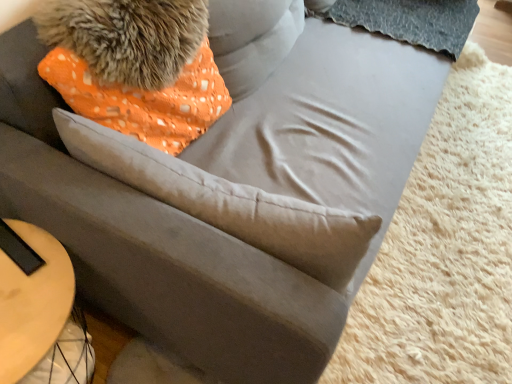
Question: In terms of height, does light wood table at lower left look taller or shorter compared to orange dotted fabric pillow at upper left?

Choices:
 (A) tall
 (B) short

Answer: (A)

Question: Is point (66, 271) positioned closer to the camera than point (176, 173)?

Choices:
 (A) closer
 (B) farther

Answer: (B)

Question: Which is nearer to the orange dotted fabric pillow at upper left?

Choices:
 (A) fuzzy fur at upper left
 (B) light wood table at lower left

Answer: (A)

Question: Which of these objects is positioned farthest from the light wood table at lower left?

Choices:
 (A) fuzzy fur at upper left
 (B) orange dotted fabric pillow at upper left

Answer: (A)